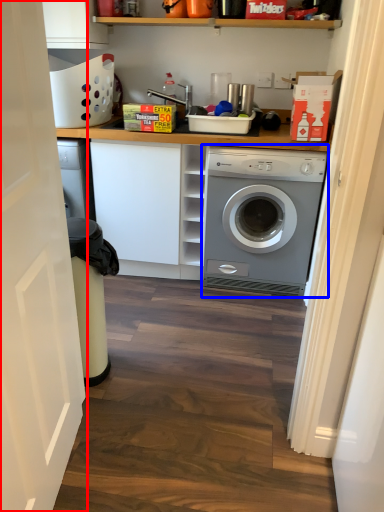
Question: Among these objects, which one is nearest to the camera, door (highlighted by a red box) or washing machine (highlighted by a blue box)?

Choices:
 (A) door
 (B) washing machine

Answer: (A)